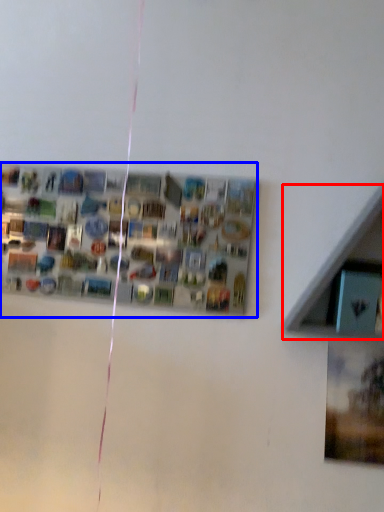
Question: Which object appears closest to the camera in this image, shelf (highlighted by a red box) or bulletin board (highlighted by a blue box)?

Choices:
 (A) shelf
 (B) bulletin board

Answer: (A)